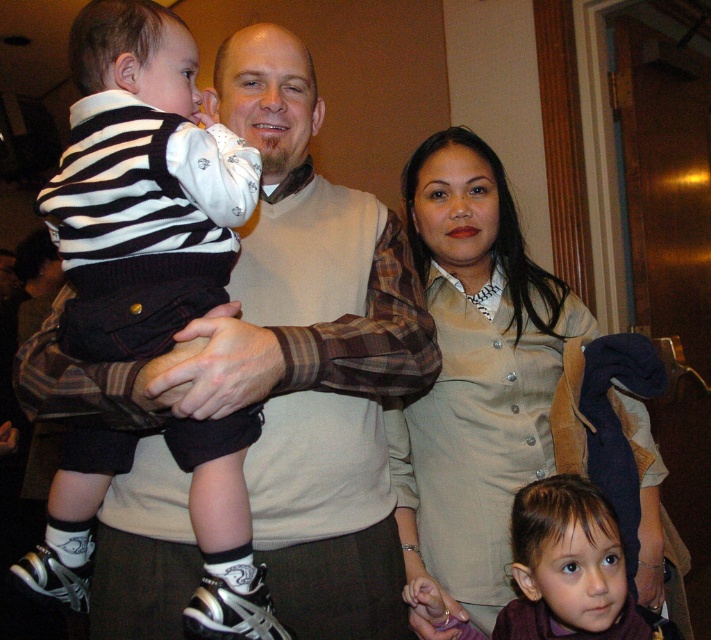
You are a photographer setting up for a family portrait. You notice the striped knit sweater at center and the brown matte hair at lower right. Which object should you focus on first if you want to capture both in the same frame without moving the camera?

The striped knit sweater at center is located above the brown matte hair at lower right, so focusing on the sweater first will ensure both are in the frame since it is higher up.